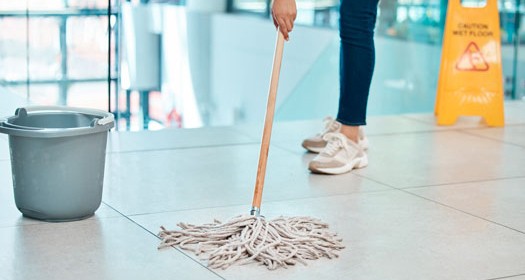
Where is `mop cleaning a floor`? mop cleaning a floor is located at coordinates (275, 240).